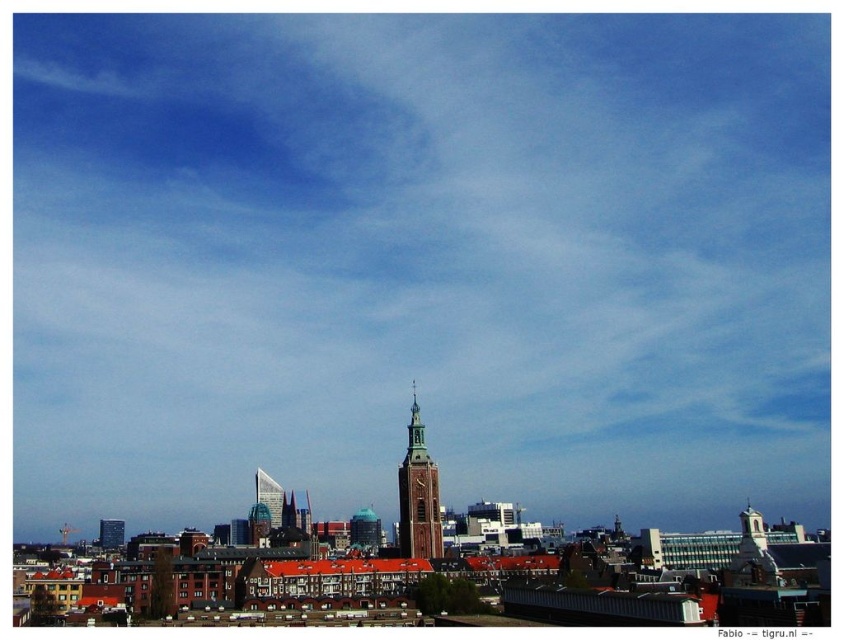
Question: Does brown brick bell tower at center lie in front of glassy steel skyscraper at center?

Choices:
 (A) yes
 (B) no

Answer: (A)

Question: Among these points, which one is farthest from the camera?

Choices:
 (A) (412, 385)
 (B) (268, 483)

Answer: (B)

Question: Is brown brick bell tower at center bigger than glassy steel skyscraper at center?

Choices:
 (A) yes
 (B) no

Answer: (A)

Question: Does brown brick bell tower at center have a smaller size compared to glassy steel skyscraper at center?

Choices:
 (A) no
 (B) yes

Answer: (A)